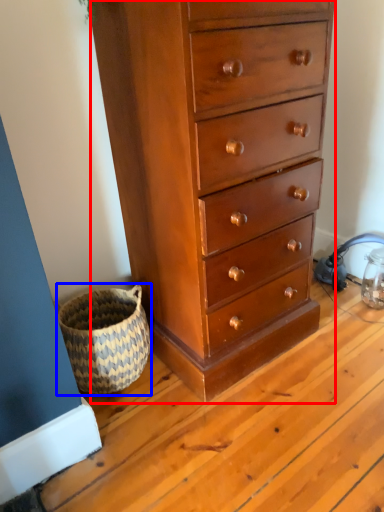
Question: Which of the following is the farthest to the observer, chest of drawers (highlighted by a red box) or basket (highlighted by a blue box)?

Choices:
 (A) chest of drawers
 (B) basket

Answer: (B)